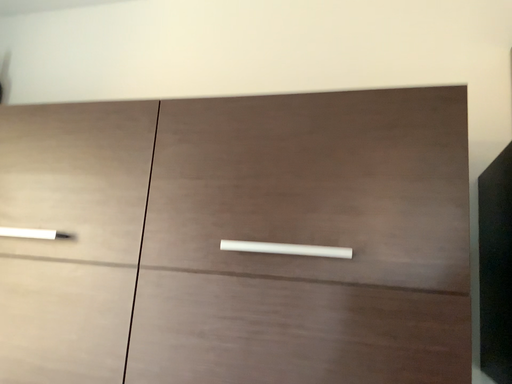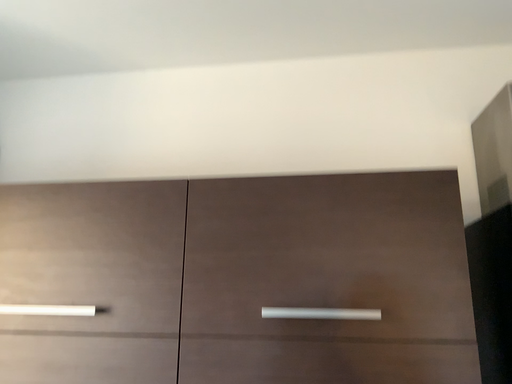
Question: Which way did the camera rotate in the video?

Choices:
 (A) rotated left
 (B) rotated right

Answer: (B)